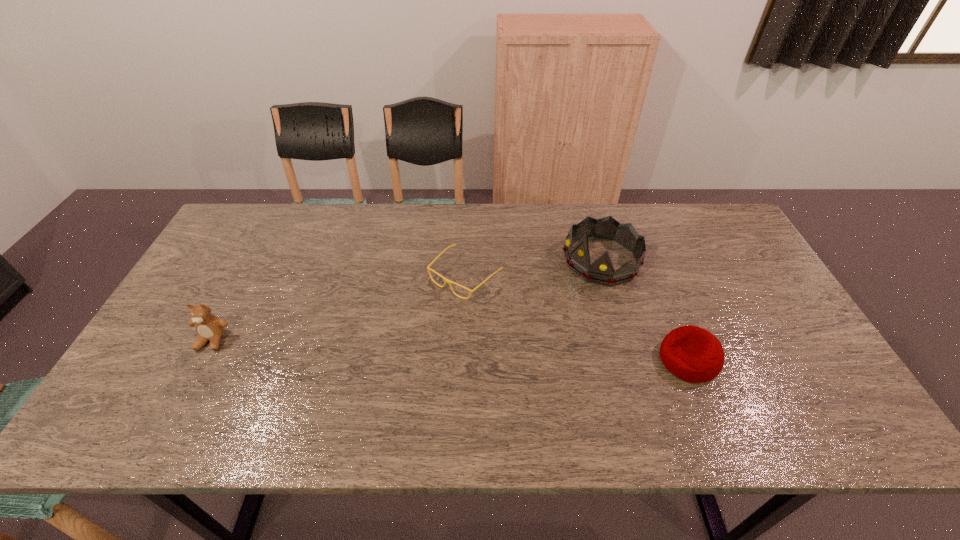
Find the location of a particular element. This screenshot has height=540, width=960. free space on the desktop that is between the leftmost object and the beanbag and is positioned at the front of the tallest object with jewels is located at coordinates (458, 350).

This screenshot has height=540, width=960. What are the coordinates of `free spot on the desktop that is between the teddy bear and the second shortest object and is positioned in front of the lenses of the spectacles` in the screenshot? It's located at (390, 347).